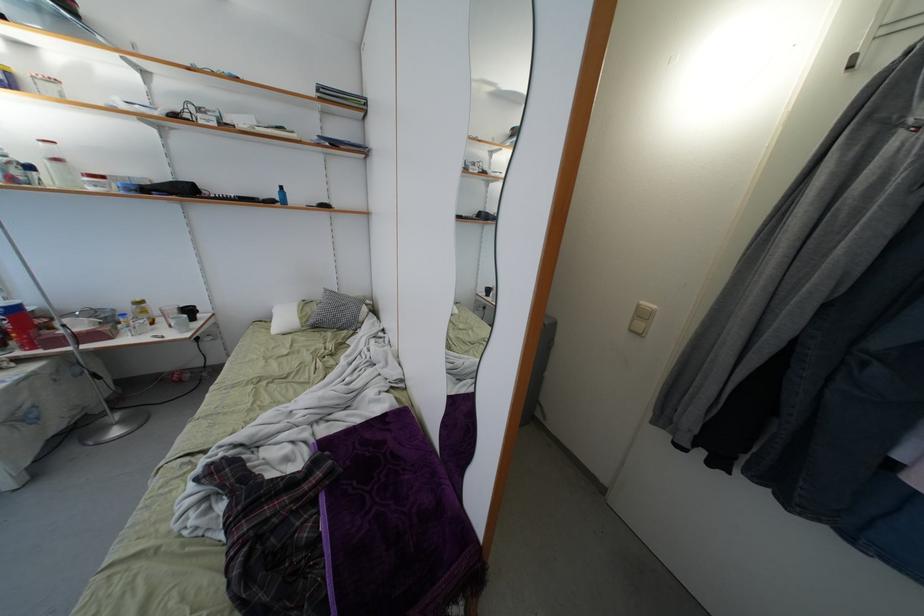
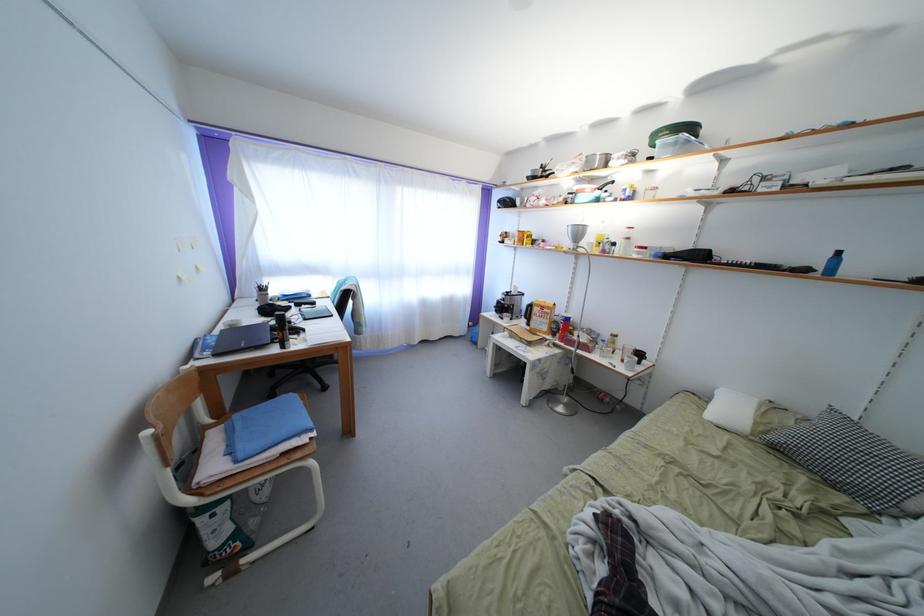
Question: How did the camera likely rotate?

Choices:
 (A) Left
 (B) Right
 (C) Up
 (D) Down

Answer: (A)